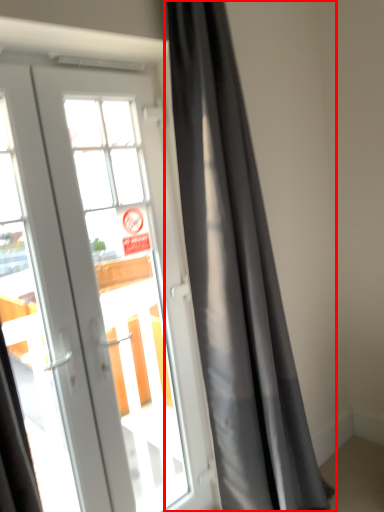
Question: From the image's perspective, where is curtain (annotated by the red box) located in relation to door in the image?

Choices:
 (A) below
 (B) above

Answer: (B)